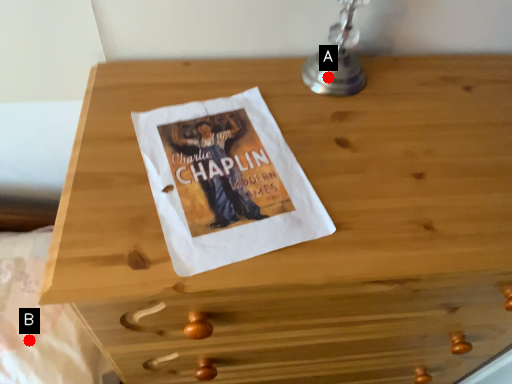
Question: Two points are circled on the image, labeled by A and B beside each circle. Which point is closer to the camera taking this photo?

Choices:
 (A) A is closer
 (B) B is closer

Answer: (A)